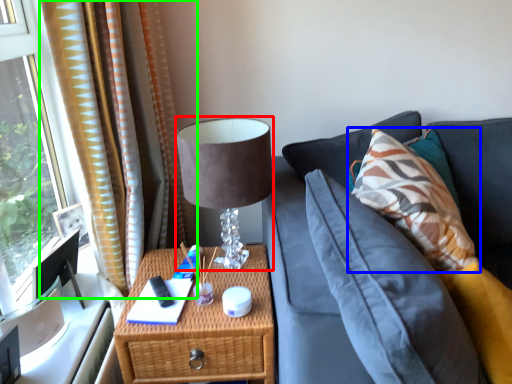
Question: Which object is positioned farthest from table lamp (highlighted by a red box)? Select from pillow (highlighted by a blue box) and curtain (highlighted by a green box).

Choices:
 (A) pillow
 (B) curtain

Answer: (A)